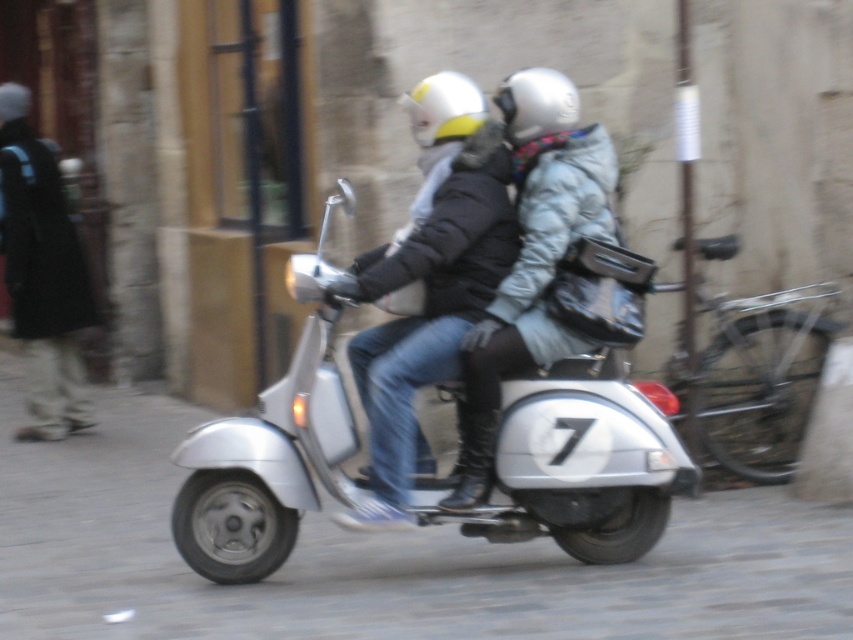
You are a delivery robot trying to navigate through the cobblestone street. The silver metallic scooter at center is your destination. There is a point at coordinates point [576,465]. Is this point located on the silver metallic scooter at center?

Yes, the point [576,465] is located on the silver metallic scooter at center according to the description.

You are a pedestrian standing on the sidewalk and see the silver scooter with two riders. There are two points marked on the image. Which point is closer to you, point at coordinate (495,518) or point at coordinate (457,88)?

Point at coordinate (495,518) is closer to you because it is further to the viewer than point at coordinate (457,88).

You are a delivery person who needs to attach a small GPS tracker to either the silver metallic scooter at center or the white matte helmet at upper center. Based on their sizes, which object would be more suitable for attaching the tracker without it being easily noticeable?

The silver metallic scooter at center is larger in size than the white matte helmet at upper center, so attaching the GPS tracker to the silver metallic scooter at center would be more suitable as it provides a larger surface area, making the tracker less noticeable compared to the smaller helmet.